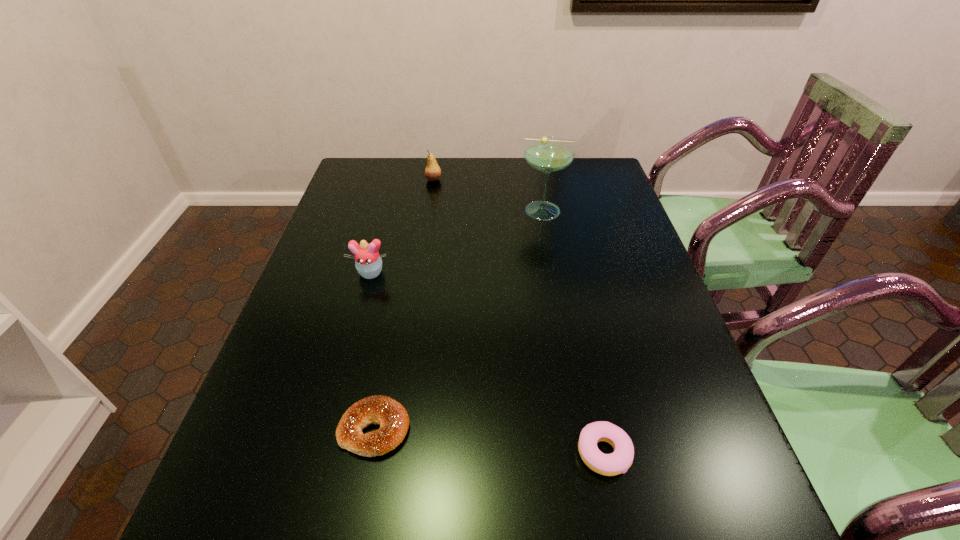
Locate an element on the screen. This screenshot has height=540, width=960. free spot that satisfies the following two spatial constraints: 1. on the front side of the pear; 2. on the left side of the doughnut is located at coordinates (393, 453).

This screenshot has height=540, width=960. What are the coordinates of `vacant space that satisfies the following two spatial constraints: 1. on the face of the third nearest object; 2. on the left side of the doughnut` in the screenshot? It's located at (322, 453).

The image size is (960, 540). Find the location of `free point that satisfies the following two spatial constraints: 1. on the face of the cupcake; 2. on the left side of the bagel`. free point that satisfies the following two spatial constraints: 1. on the face of the cupcake; 2. on the left side of the bagel is located at coordinates (328, 429).

Image resolution: width=960 pixels, height=540 pixels. I want to click on free region that satisfies the following two spatial constraints: 1. on the face of the doughnut; 2. on the right side of the third nearest object, so click(322, 453).